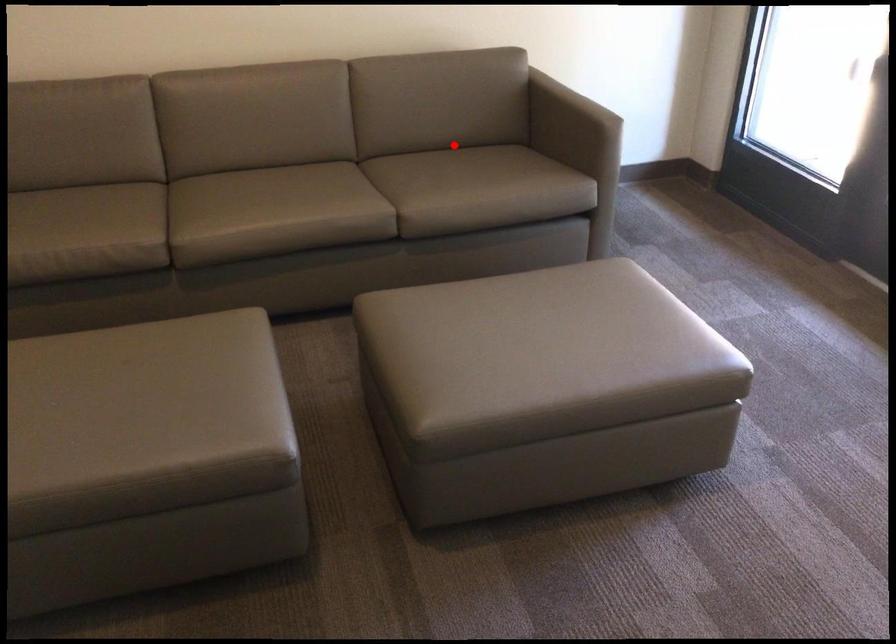
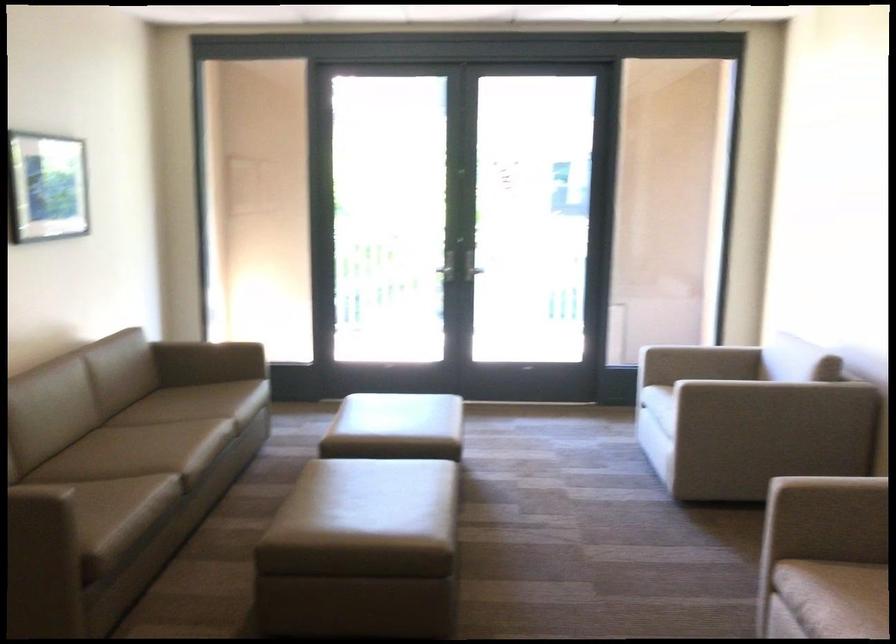
The point at the highlighted location is marked in the first image. Where is the corresponding point in the second image?

(122, 399)